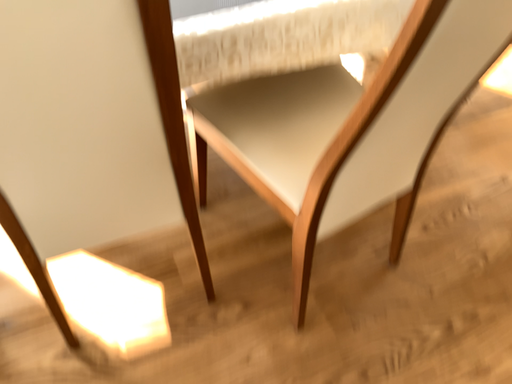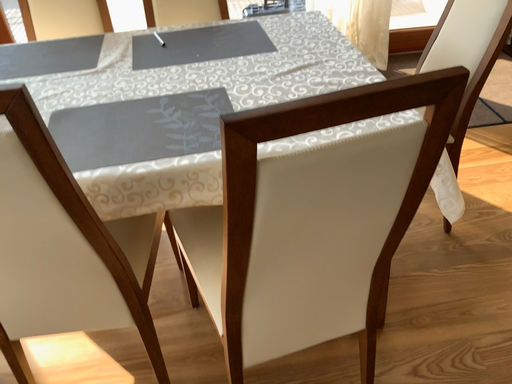
Question: Which way did the camera rotate in the video?

Choices:
 (A) rotated downward
 (B) rotated upward

Answer: (B)